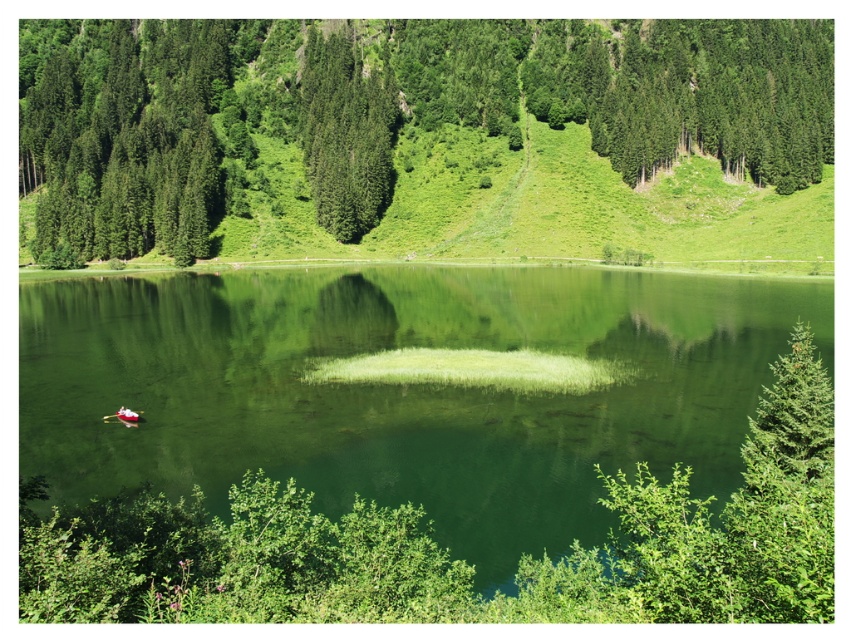
Does point (457, 289) come in front of point (353, 115)?

Yes.

Looking at this image, is the position of green smooth water at center less distant than that of green textured tree at upper center?

Yes, it is.

This screenshot has width=851, height=640. What are the coordinates of `green smooth water at center` in the screenshot? It's located at (401, 387).

Identify the location of green smooth water at center. The image size is (851, 640). (401, 387).

Which is in front, point (630, 362) or point (278, 93)?

Positioned in front is point (630, 362).

Where is `green smooth water at center`? The height and width of the screenshot is (640, 851). green smooth water at center is located at coordinates (401, 387).

Can you confirm if green matte tree at center is smaller than green textured tree at upper center?

No.

The height and width of the screenshot is (640, 851). In order to click on green matte tree at center in this screenshot , I will do `click(386, 113)`.

Find the location of `green matte tree at center`. green matte tree at center is located at coordinates 386,113.